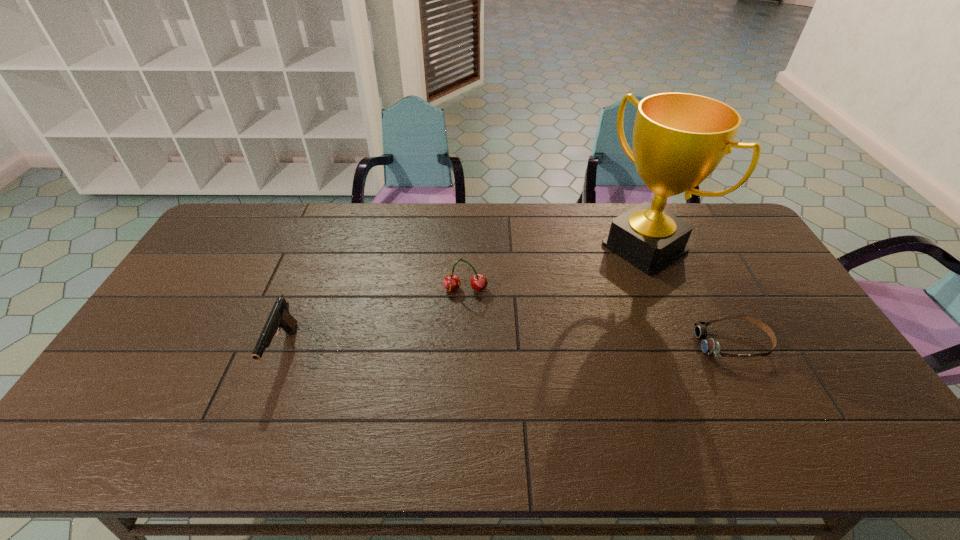
Locate an element on the screen. This screenshot has width=960, height=540. empty location between the second object from left to right and the goggles is located at coordinates (599, 316).

Identify which object is located as the second nearest to the leftmost object. Please provide its 2D coordinates. Your answer should be formatted as a tuple, i.e. [(x, y)], where the tuple contains the x and y coordinates of a point satisfying the conditions above.

[(679, 139)]

Point out which object is positioned as the third nearest to the award. Please provide its 2D coordinates. Your answer should be formatted as a tuple, i.e. [(x, y)], where the tuple contains the x and y coordinates of a point satisfying the conditions above.

[(279, 317)]

Locate an element on the screen. This screenshot has width=960, height=540. vacant area in the image that satisfies the following two spatial constraints: 1. on the back side of the award; 2. on the right side of the cherry is located at coordinates (468, 247).

Locate an element on the screen. This screenshot has height=540, width=960. free location that satisfies the following two spatial constraints: 1. on the back side of the third object from right to left; 2. on the left side of the award is located at coordinates pyautogui.click(x=468, y=247).

This screenshot has height=540, width=960. Find the location of `free location that satisfies the following two spatial constraints: 1. on the front side of the shortest object; 2. on the front-facing side of the cherry`. free location that satisfies the following two spatial constraints: 1. on the front side of the shortest object; 2. on the front-facing side of the cherry is located at coordinates (464, 343).

Identify the location of free region that satisfies the following two spatial constraints: 1. on the front side of the goggles; 2. on the front-facing side of the tallest object. The height and width of the screenshot is (540, 960). (684, 343).

The width and height of the screenshot is (960, 540). I want to click on free region that satisfies the following two spatial constraints: 1. on the front side of the shortest object; 2. on the front-facing side of the award, so click(x=684, y=343).